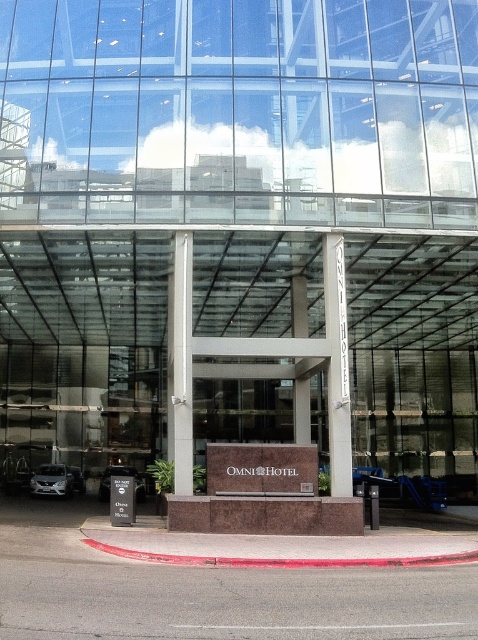
Question: Does white stone sign at center have a smaller size compared to shiny silver car at lower left?

Choices:
 (A) yes
 (B) no

Answer: (B)

Question: Can you confirm if satin silver column at center is positioned above shiny silver car at lower left?

Choices:
 (A) no
 (B) yes

Answer: (B)

Question: Which of the following is the farthest from the observer?

Choices:
 (A) (192, 416)
 (B) (347, 400)
 (C) (104, 486)

Answer: (C)

Question: Is satin silver column at center further to camera compared to satin silver sedan at lower left?

Choices:
 (A) yes
 (B) no

Answer: (B)

Question: Which of the following is the closest to the observer?

Choices:
 (A) white stone sign at center
 (B) satin silver sedan at lower left

Answer: (A)

Question: Among these points, which one is nearest to the camera?

Choices:
 (A) (171, 397)
 (B) (60, 467)
 (C) (122, 467)
 (D) (337, 493)

Answer: (D)